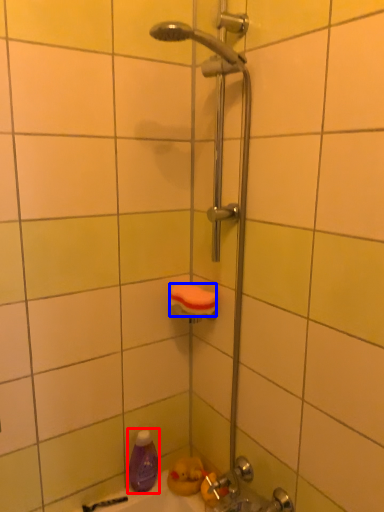
Question: Which object appears farthest to the camera in this image, cleaning product (highlighted by a red box) or towel bar (highlighted by a blue box)?

Choices:
 (A) cleaning product
 (B) towel bar

Answer: (A)